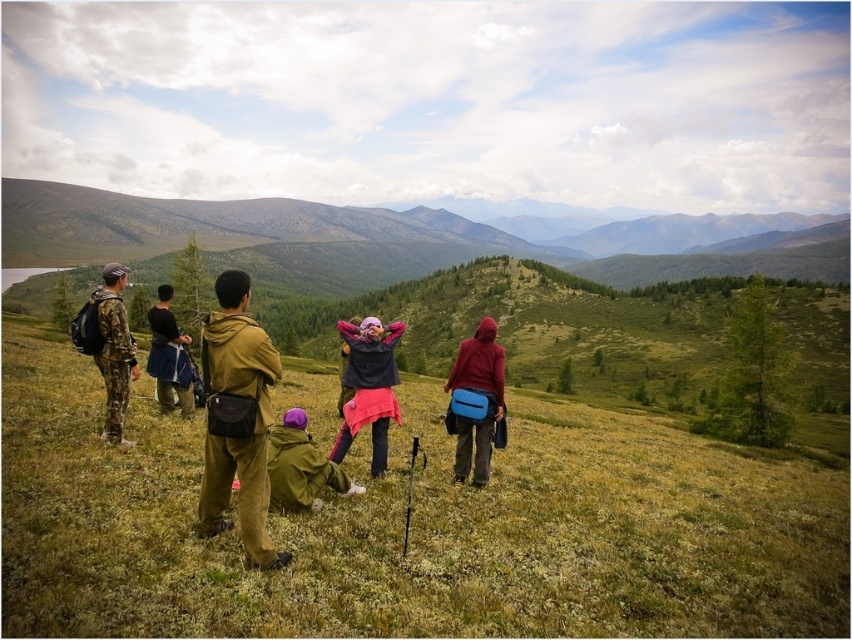
Question: Can you confirm if green grassy at center is positioned above dark blue fabric jacket at center?

Choices:
 (A) no
 (B) yes

Answer: (A)

Question: Is green grassy hill at upper center smaller than pink fabric at center?

Choices:
 (A) no
 (B) yes

Answer: (A)

Question: Based on their relative distances, which object is farther from the green grassy at center?

Choices:
 (A) maroon fleece jacket at center
 (B) green grassy hill at upper center
 (C) pink fabric at center

Answer: (B)

Question: Which point is farther from the camera taking this photo?

Choices:
 (A) (371, 442)
 (B) (95, 291)
 (C) (655, 540)
 (D) (164, 396)

Answer: (B)

Question: In this image, where is brown corduroy jacket at center located relative to dark blue fabric jacket at center?

Choices:
 (A) below
 (B) above

Answer: (B)

Question: Among these objects, which one is nearest to the camera?

Choices:
 (A) pink fabric at center
 (B) green grassy at center
 (C) camouflage pants at left

Answer: (B)